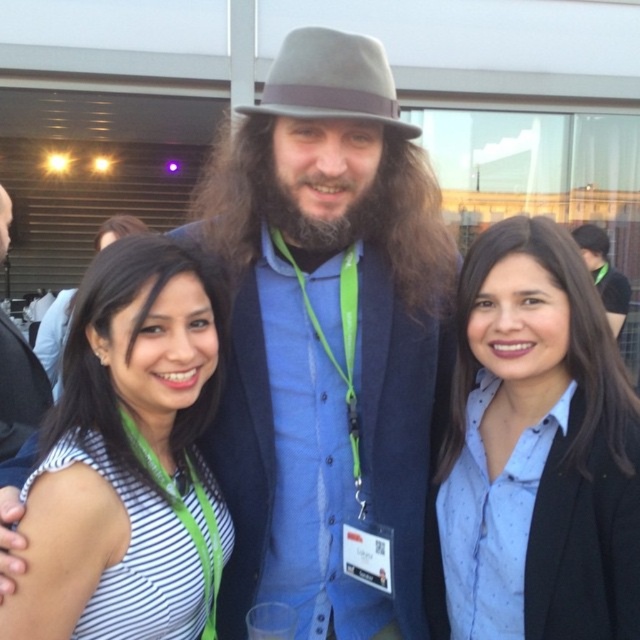
Question: Is white striped shirt at center to the right of dark brown hair at center from the viewer's perspective?

Choices:
 (A) yes
 (B) no

Answer: (B)

Question: Can you confirm if brown fuzzy beard at center is bigger than dark brown hair at center?

Choices:
 (A) no
 (B) yes

Answer: (A)

Question: Which point appears closest to the camera in this image?

Choices:
 (A) (156, 300)
 (B) (490, 408)

Answer: (A)

Question: Does blue dotted shirt at center have a smaller size compared to gray felt fedora at center?

Choices:
 (A) yes
 (B) no

Answer: (B)

Question: Which object appears farthest from the camera in this image?

Choices:
 (A) matte black hair at center
 (B) matte gray fedora at center

Answer: (A)

Question: Which of the following is the farthest from the observer?

Choices:
 (A) gray felt fedora at center
 (B) matte black hair at center

Answer: (B)